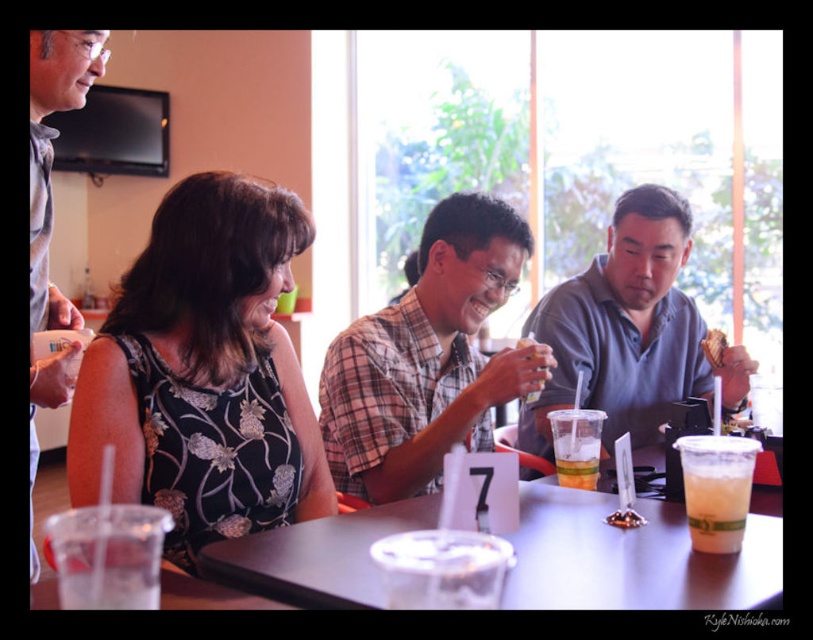
From the picture: Who is lower down, plaid fabric shirt at center or brown crumbly bread at right?

Positioned lower is plaid fabric shirt at center.

Identify the location of plaid fabric shirt at center. The width and height of the screenshot is (813, 640). (425, 356).

This screenshot has width=813, height=640. Identify the location of plaid fabric shirt at center. (425, 356).

Is clear plastic table at center thinner than clear plastic cup at lower left?

In fact, clear plastic table at center might be wider than clear plastic cup at lower left.

Does clear plastic table at center appear over clear plastic cup at lower left?

No.

Is point (733, 586) less distant than point (120, 508)?

No, it is behind (120, 508).

Where is `clear plastic table at center`? This screenshot has width=813, height=640. clear plastic table at center is located at coordinates [633, 557].

Does clear plastic table at center appear over gray cotton shirt at right?

Incorrect, clear plastic table at center is not positioned above gray cotton shirt at right.

Which is in front, point (685, 556) or point (587, 305)?

Positioned in front is point (685, 556).

Which is behind, point (546, 600) or point (659, 396)?

Point (659, 396)

The width and height of the screenshot is (813, 640). In order to click on clear plastic table at center in this screenshot , I will do `click(633, 557)`.